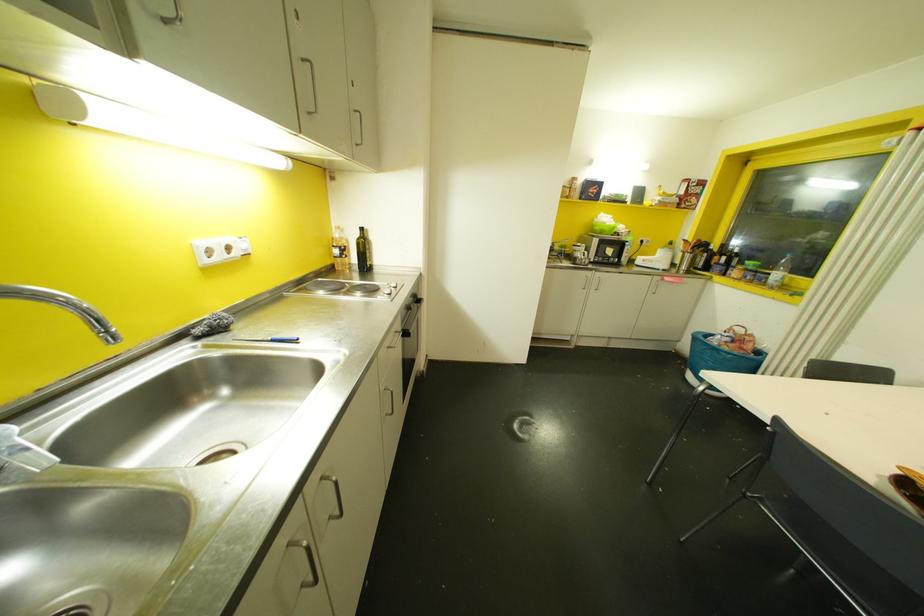
Find where to lift the faucet handle. Please return your answer as a coordinate pair (x, y).

(96, 323)